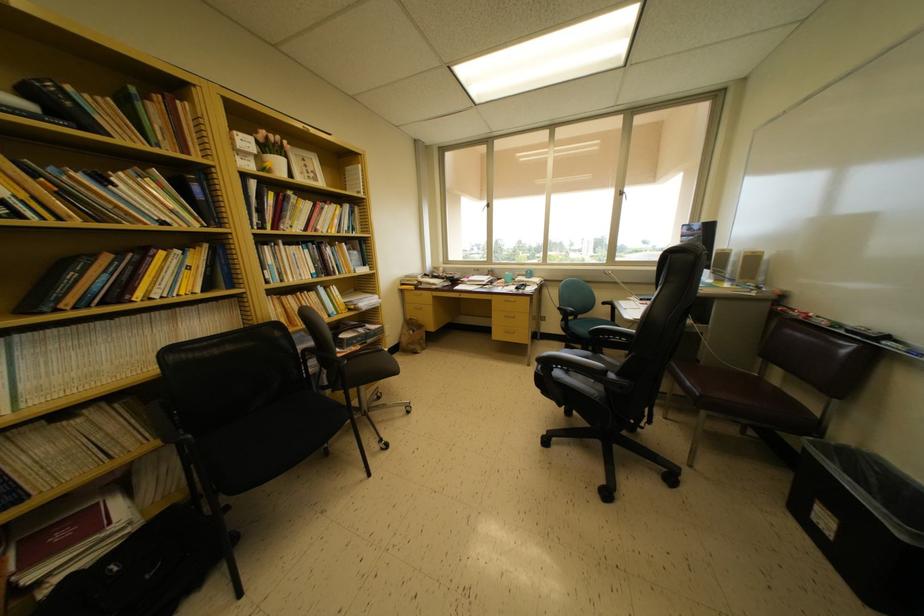
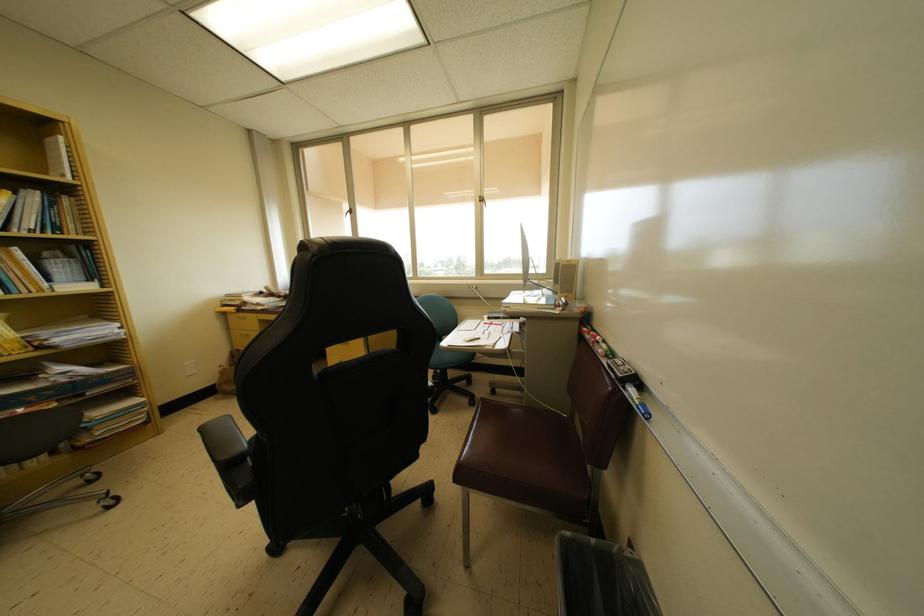
The point at (x=758, y=257) is marked in the first image. Where is the corresponding point in the second image?

(572, 265)